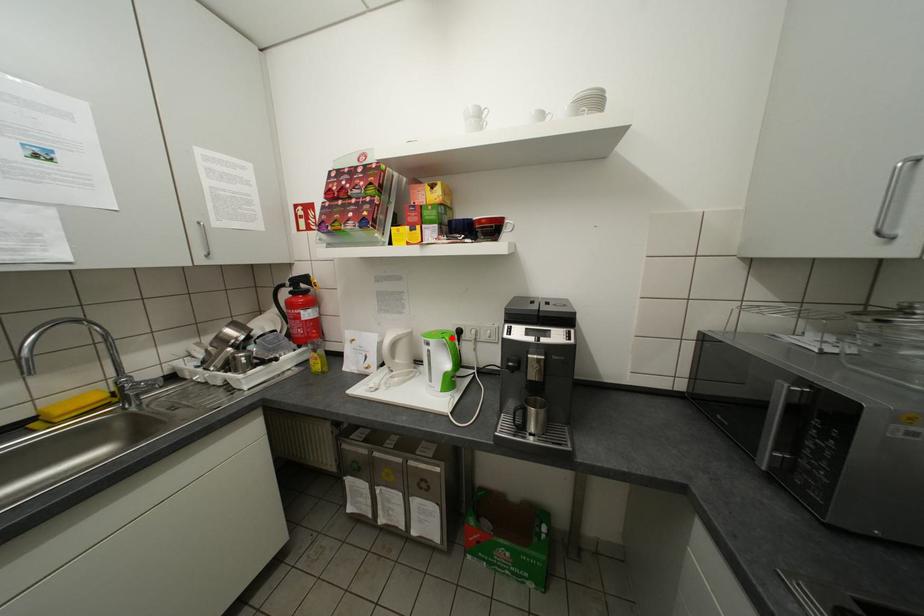
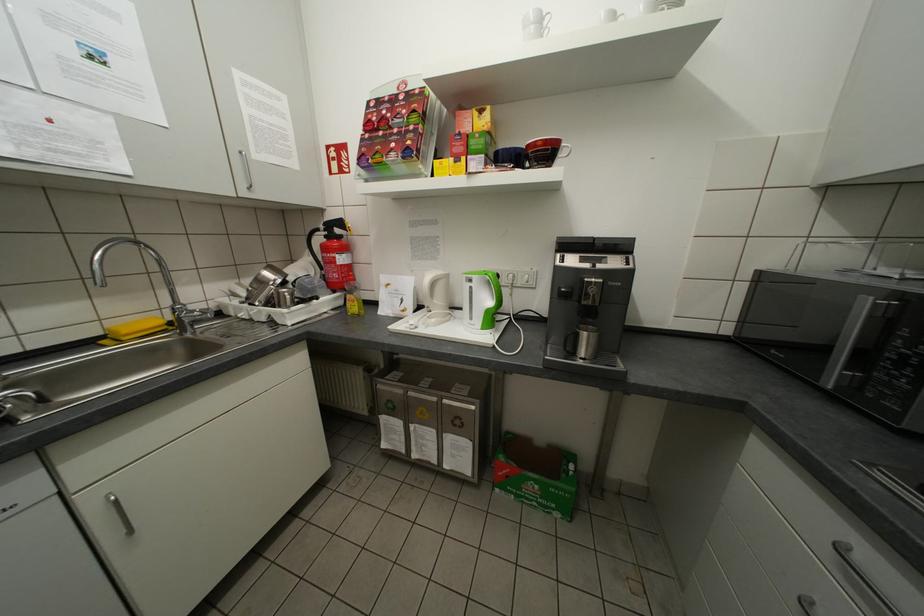
Find the pixel in the second image that matches the highlighted location in the first image.

(494, 274)